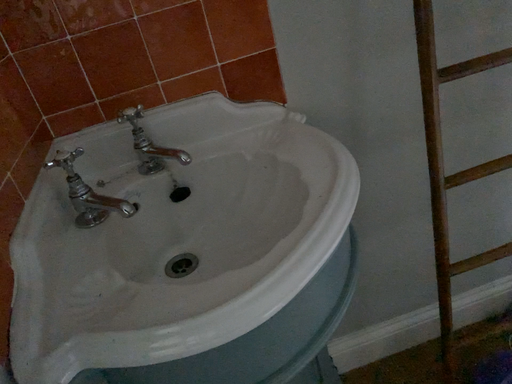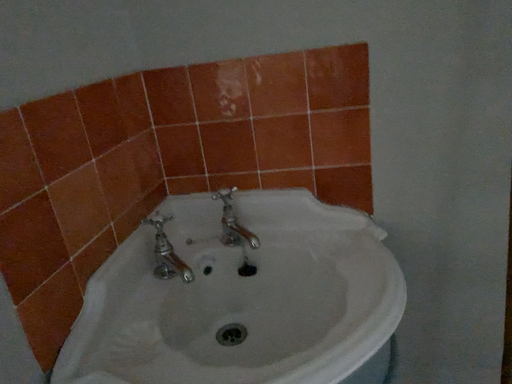
Question: Which way did the camera rotate in the video?

Choices:
 (A) rotated downward
 (B) rotated upward

Answer: (B)